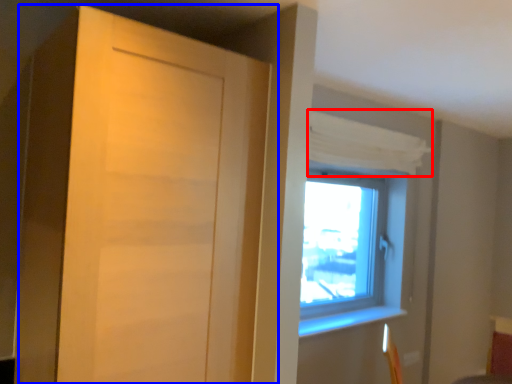
Question: Which object is further to the camera taking this photo, curtain (highlighted by a red box) or door (highlighted by a blue box)?

Choices:
 (A) curtain
 (B) door

Answer: (A)